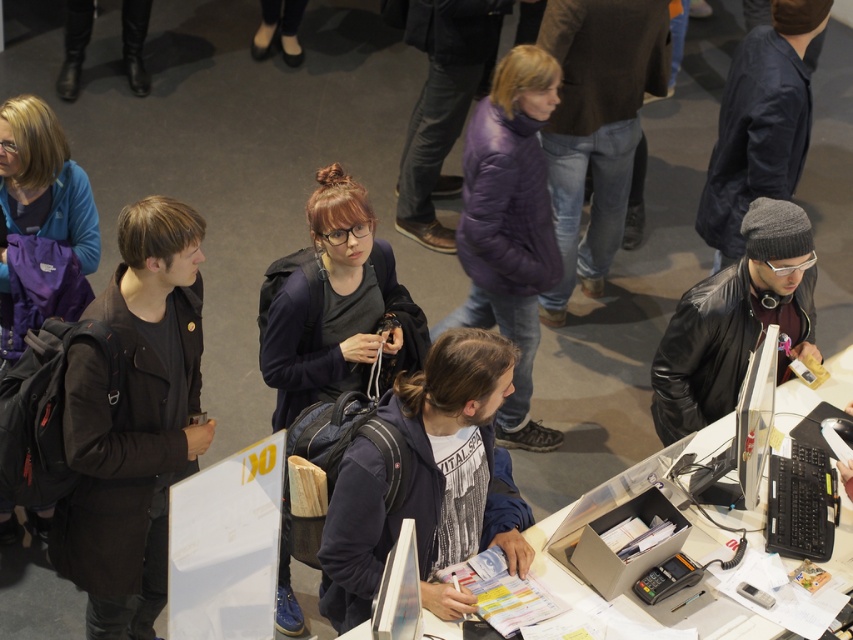
In the scene shown: How far apart are dark gray backpack at center and purple puffy jacket at center?

1.41 meters

Which is in front, point (511, 506) or point (467, 269)?

Point (511, 506)

Where is `dark gray backpack at center`? dark gray backpack at center is located at coordinates (428, 481).

Is dark brown leather jacket at left positioned in front of dark blue jacket at center?

Yes.

How far apart are dark brown leather jacket at left and dark blue jacket at center?

The distance of dark brown leather jacket at left from dark blue jacket at center is 23.04 inches.

Between point (181, 280) and point (407, 300), which one is positioned behind?

The point (407, 300) is behind.

This screenshot has height=640, width=853. Identify the location of dark brown leather jacket at left. (132, 420).

Is denim jeans at center wider than purple fabric backpack at left?

Yes, denim jeans at center is wider than purple fabric backpack at left.

Does denim jeans at center come behind purple fabric backpack at left?

Yes, denim jeans at center is further from the viewer.

Between point (625, 134) and point (1, 541), which one is positioned in front?

Positioned in front is point (1, 541).

The image size is (853, 640). Find the location of `denim jeans at center`. denim jeans at center is located at coordinates (596, 125).